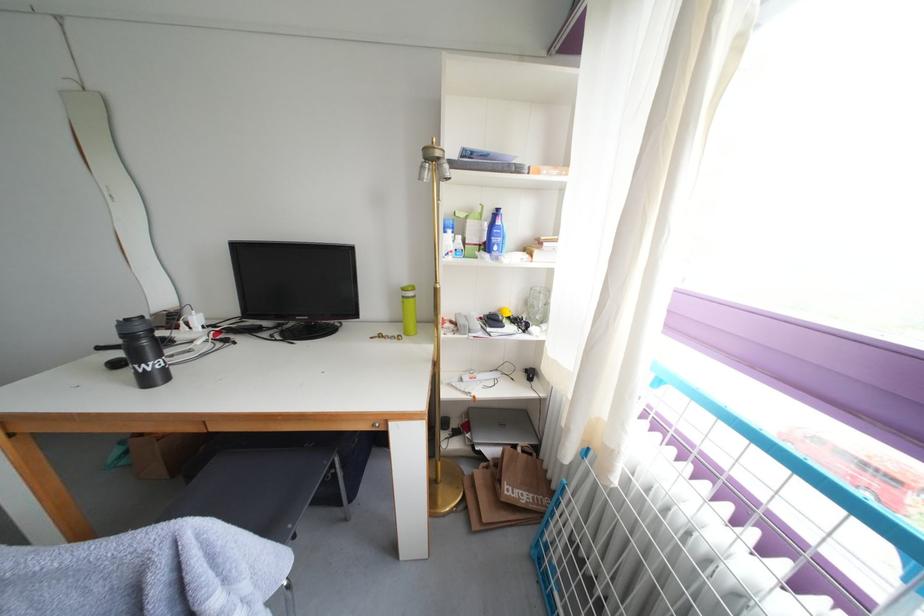
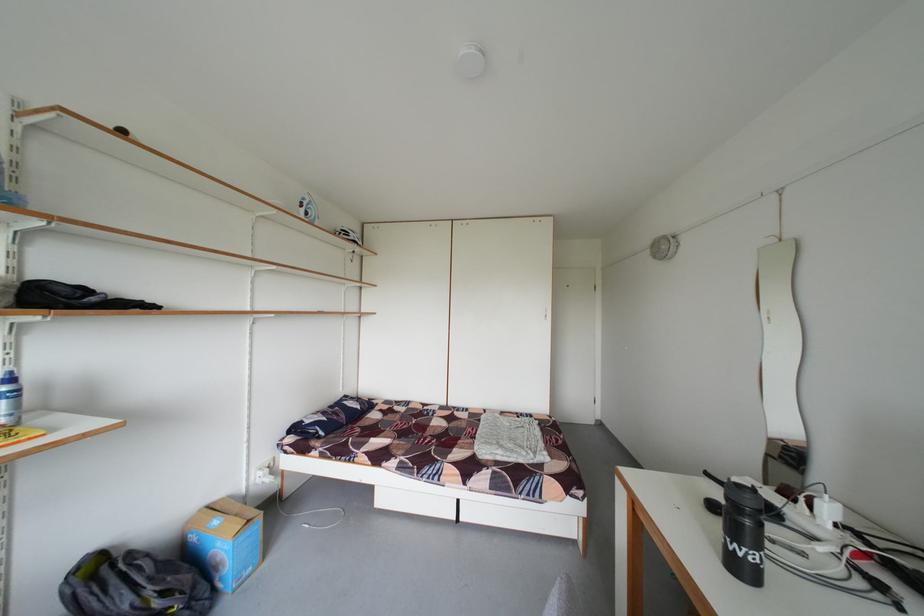
Question: Based on the continuous images, in which direction is the camera rotating? Reply with the corresponding letter.

Choices:
 (A) Left
 (B) Right
 (C) Up
 (D) Down

Answer: (A)